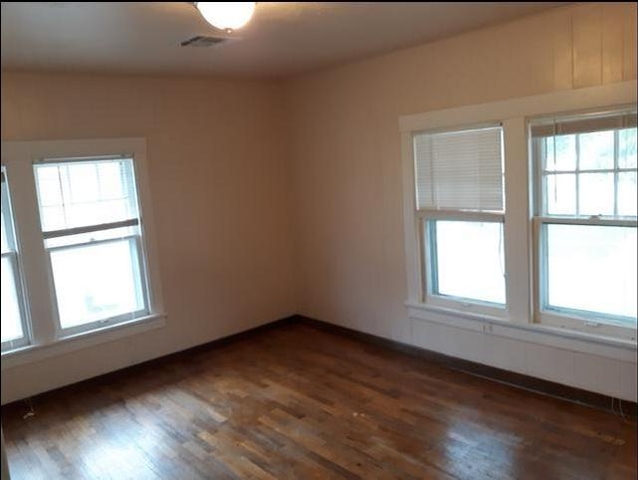
Locate an element on the screen. blinds that are halfway down is located at coordinates (457, 187), (106, 208).